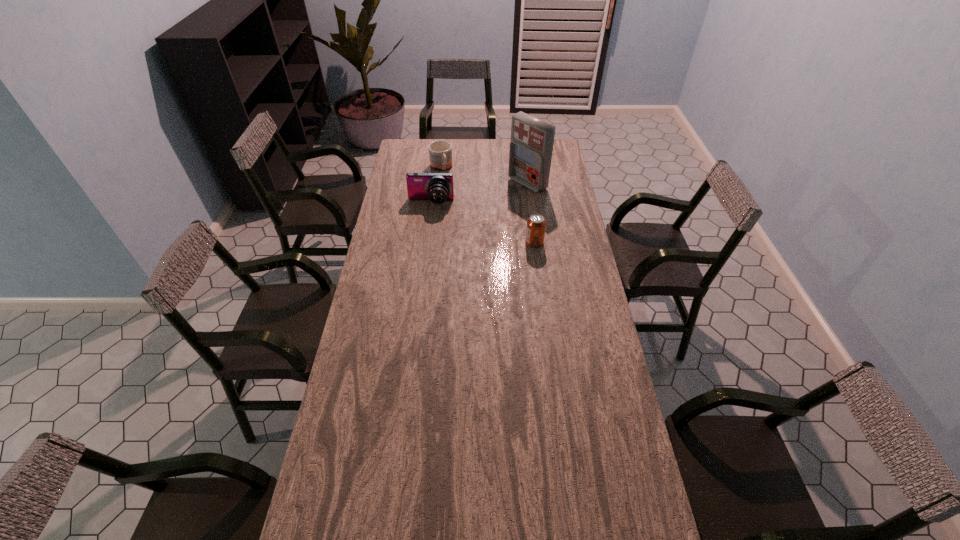
Identify the location of object that is the nearest to the camera. The height and width of the screenshot is (540, 960). (440, 152).

The height and width of the screenshot is (540, 960). I want to click on free location that satisfies the following two spatial constraints: 1. on the back side of the tallest object; 2. on the left side of the nearest object, so click(527, 184).

I want to click on free point that satisfies the following two spatial constraints: 1. on the front-facing side of the second nearest object; 2. on the right side of the can, so click(425, 242).

Locate an element on the screen. This screenshot has height=540, width=960. vacant area that satisfies the following two spatial constraints: 1. on the front-facing side of the can; 2. on the left side of the camera is located at coordinates (425, 242).